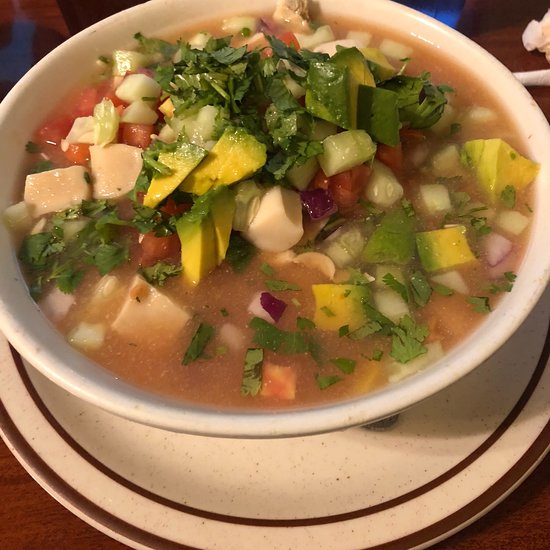
Image resolution: width=550 pixels, height=550 pixels. What are the coordinates of `napkin` in the screenshot? It's located at point(537,40).